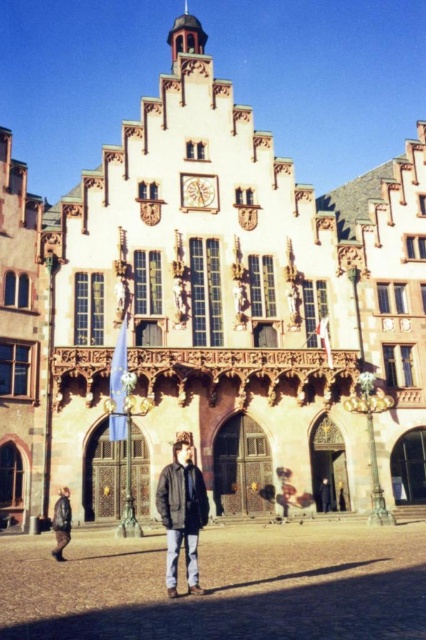
You are a tourist in the town square and want to take a photo of both the dark brown stone building at left and the dark brown leather jacket at lower left. Since you can only focus on one object at a time, which one should you choose to ensure the other is still in the frame?

Since the dark brown stone building at left is larger in size than the dark brown leather jacket at lower left, you should focus on the dark brown stone building at left to ensure the smaller dark brown leather jacket at lower left remains in the frame.

You are standing in the town square and see the dark brown stone building at left and the dark brown leather jacket at lower left. Which object is wider?

The dark brown stone building at left is wider than the dark brown leather jacket at lower left according to the description provided.

You are standing in the town square and see the wooden carved clock at center and the dark gray jacket at center. If you want to reach both objects, which one is closer to you?

The dark gray jacket at center is closer to you because the wooden carved clock at center is 25.48 meters away from it, meaning the jacket is at your current position.